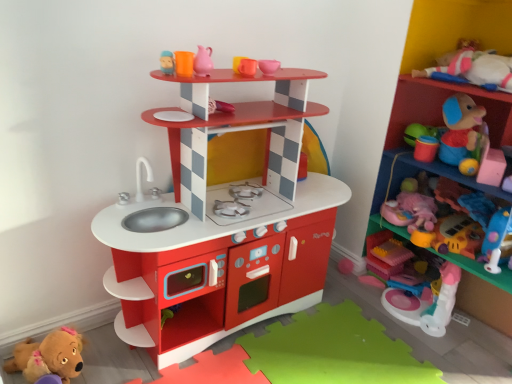
In order to click on vacant area to the right of brown plush toy at lower left, which ranks as the first toy in bottom-to-top order in this screenshot , I will do `click(118, 365)`.